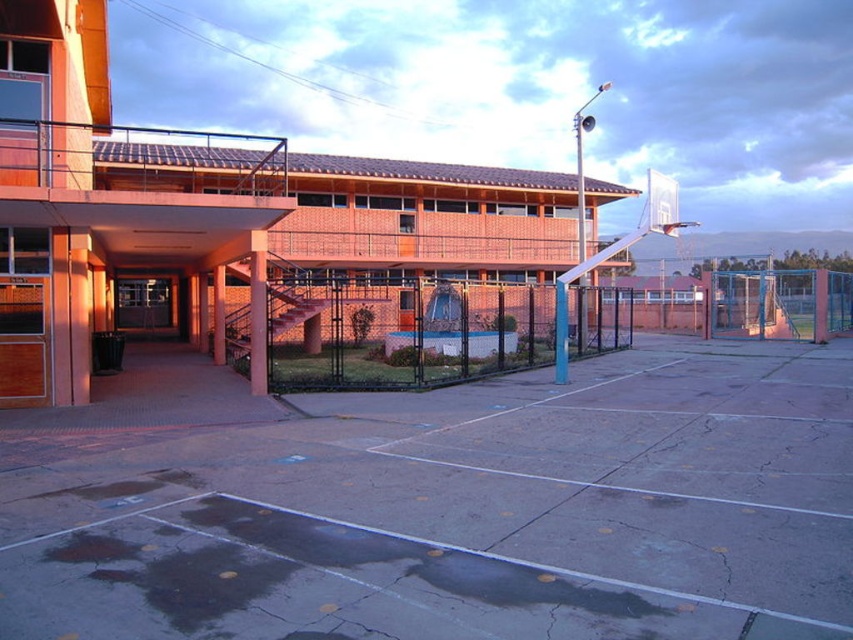
Consider the image. You are standing at the entrance of the building and want to walk to the basketball hoop on the court. Which object will you see first as you approach the court? The concrete at center or the black wire mesh fence at center?

The concrete at center is in front of the black wire mesh fence at center, so you will see the concrete at center first as you approach the court.

You are a maintenance worker inspecting the basketball court. You notice the concrete at center and the black wire mesh fence at center. Which object is positioned lower in the scene?

The concrete at center is located below the black wire mesh fence at center, so the concrete at center is positioned lower in the scene.